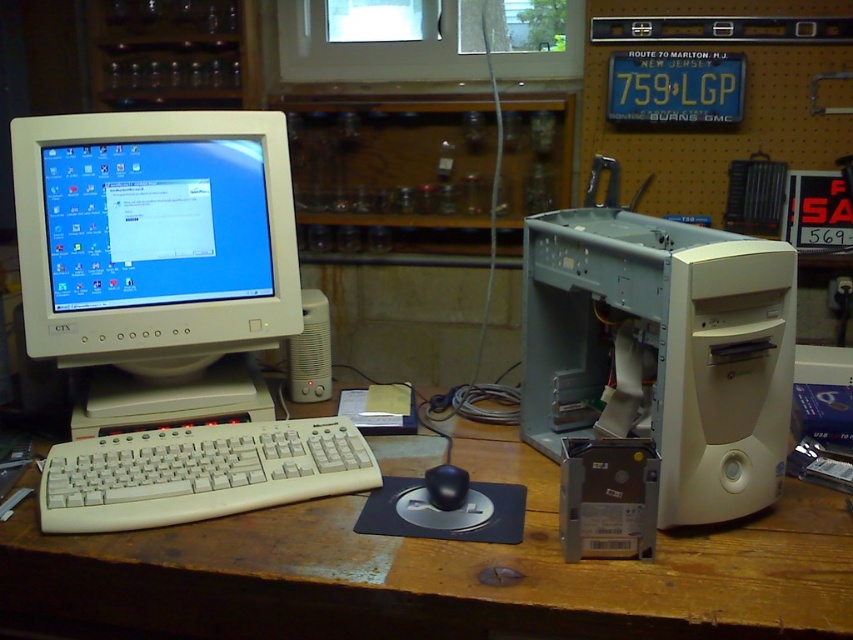
Who is positioned more to the right, matte white monitor at left or white plastic computer case at center-right?

Positioned to the right is white plastic computer case at center-right.

Looking at this image, does matte white monitor at left have a greater width compared to white plastic computer case at center-right?

Yes, matte white monitor at left is wider than white plastic computer case at center-right.

Describe the element at coordinates (154, 237) in the screenshot. I see `matte white monitor at left` at that location.

Locate an element on the screen. Image resolution: width=853 pixels, height=640 pixels. matte white monitor at left is located at coordinates (154, 237).

Does white plastic keyboard at lower left have a larger size compared to black plastic mouse at center?

Indeed, white plastic keyboard at lower left has a larger size compared to black plastic mouse at center.

Can you confirm if white plastic keyboard at lower left is taller than black plastic mouse at center?

Yes.

Is point (276, 435) positioned behind point (440, 493)?

That is True.

What are the coordinates of `white plastic keyboard at lower left` in the screenshot? It's located at (199, 472).

Between matte white monitor at left and black plastic mouse at center, which one is positioned higher?

matte white monitor at left is higher up.

Does matte white monitor at left lie in front of black plastic mouse at center?

No, it is not.

This screenshot has height=640, width=853. What do you see at coordinates (154, 237) in the screenshot? I see `matte white monitor at left` at bounding box center [154, 237].

You are a GUI agent. You are given a task and a screenshot of the screen. Output one action in this format:
    pyautogui.click(x=<x>, y=<y>)
    Task: Click on the matte white monitor at left
    This screenshot has height=640, width=853.
    Given the screenshot: What is the action you would take?
    pyautogui.click(x=154, y=237)